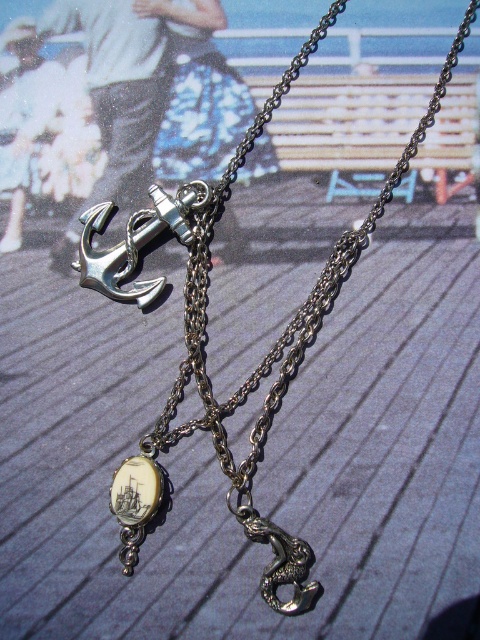
Looking at this image, you are a jeweler examining the necklace from the front. Which pendant, the antique silver anchor at center or the silver metallic anchor at upper left, appears larger in your view?

The antique silver anchor at center appears larger because it is closer to the viewer than the silver metallic anchor at upper left.